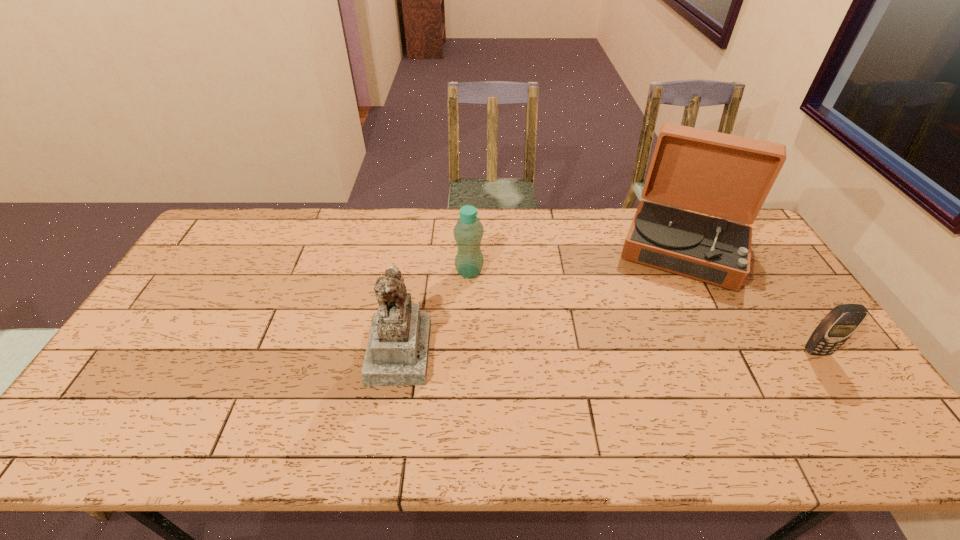
This screenshot has height=540, width=960. Find the location of `vacant space that is in between the leftmost object and the shortest object`. vacant space that is in between the leftmost object and the shortest object is located at coordinates (608, 351).

Locate an element on the screen. The image size is (960, 540). free space between the cellular telephone and the second shortest object is located at coordinates (643, 312).

Where is `vacant area that lies between the cellular telephone and the phonograph record`? vacant area that lies between the cellular telephone and the phonograph record is located at coordinates point(750,299).

This screenshot has width=960, height=540. In order to click on the second closest object to the shortest object in this screenshot , I will do `click(468, 232)`.

Where is `object that stands as the third closest to the leftmost object`? The height and width of the screenshot is (540, 960). object that stands as the third closest to the leftmost object is located at coordinates [842, 321].

The height and width of the screenshot is (540, 960). What are the coordinates of `vacant space that satisfies the following two spatial constraints: 1. on the back side of the phonograph record; 2. on the left side of the third tallest object` in the screenshot? It's located at (470, 247).